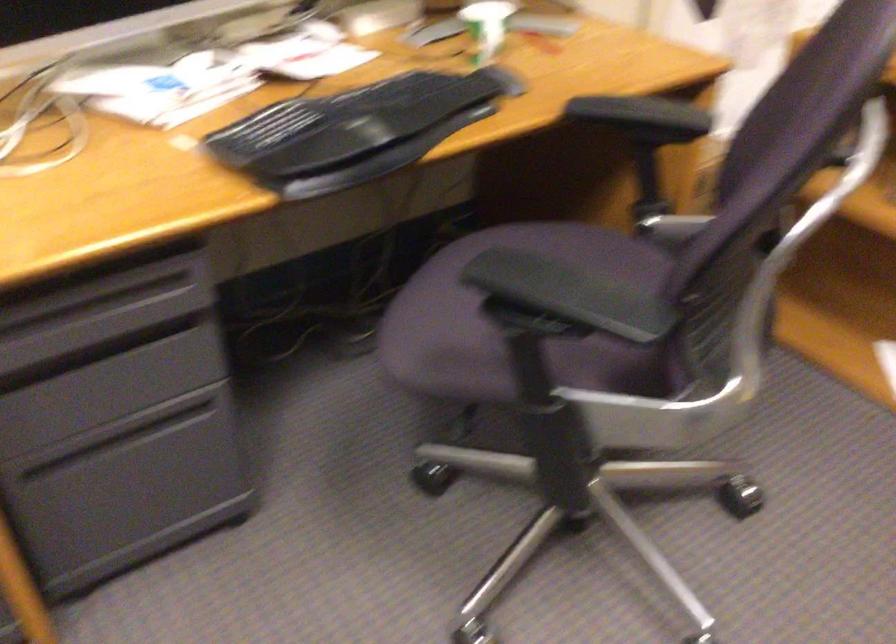
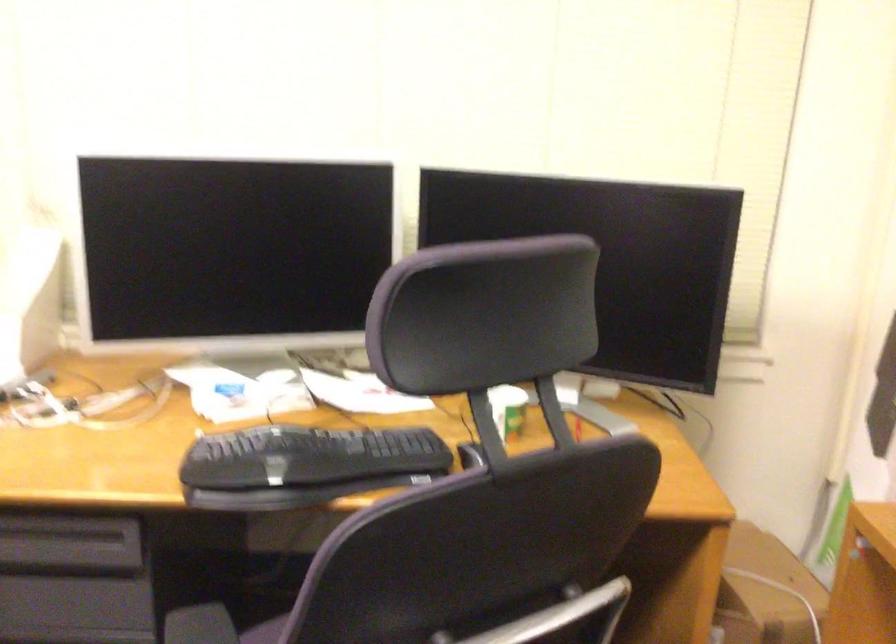
Question: I am providing you with two images of the same scene from different viewpoints. After the viewpoint changes to image2, which objects are now occluded?

Choices:
 (A) large cloth bag
 (B) black chair armrest
 (C) drawer handle
 (D) white paper cup

Answer: (B)